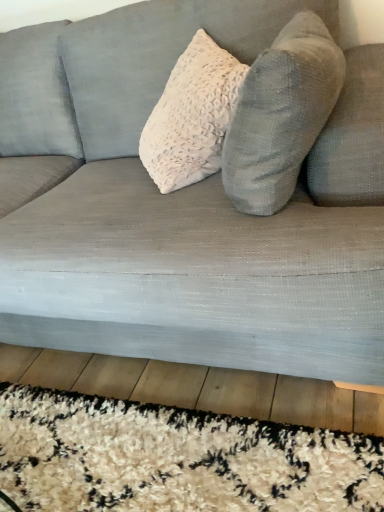
The image size is (384, 512). What are the coordinates of `white shaggy rug at lower center` in the screenshot? It's located at (175, 459).

What do you see at coordinates (175, 459) in the screenshot?
I see `white shaggy rug at lower center` at bounding box center [175, 459].

The height and width of the screenshot is (512, 384). In order to click on white shaggy rug at lower center in this screenshot , I will do `click(175, 459)`.